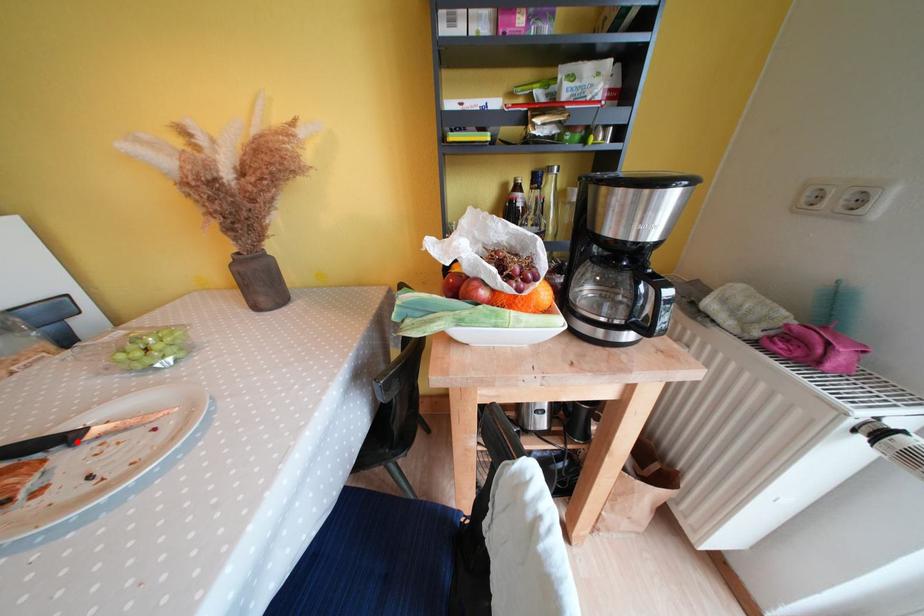
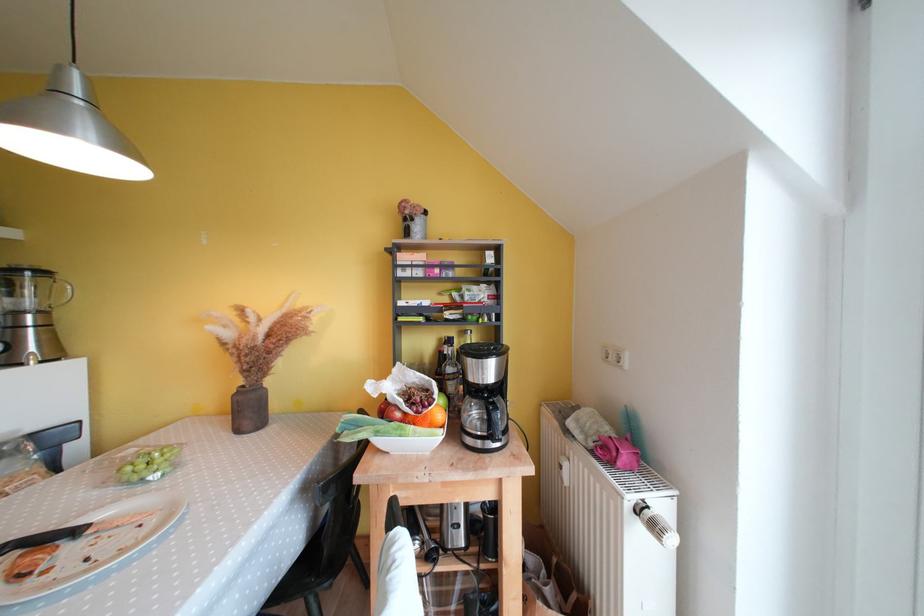
In the second image, find the point that corresponds to the highlighted location in the first image.

(83, 535)